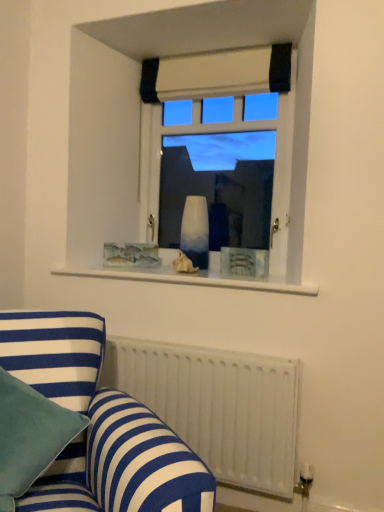
Question: Is white metallic radiator at lower right bigger than teal velvet pillow at lower left?

Choices:
 (A) yes
 (B) no

Answer: (A)

Question: Is the position of white metallic radiator at lower right more distant than that of teal velvet pillow at lower left?

Choices:
 (A) yes
 (B) no

Answer: (A)

Question: Is the surface of white metallic radiator at lower right in direct contact with teal velvet pillow at lower left?

Choices:
 (A) yes
 (B) no

Answer: (B)

Question: From a real-world perspective, is white metallic radiator at lower right over teal velvet pillow at lower left?

Choices:
 (A) no
 (B) yes

Answer: (A)

Question: Considering the relative positions of white metallic radiator at lower right and teal velvet pillow at lower left in the image provided, is white metallic radiator at lower right to the left of teal velvet pillow at lower left from the viewer's perspective?

Choices:
 (A) no
 (B) yes

Answer: (A)

Question: Are white metallic radiator at lower right and teal velvet pillow at lower left far apart?

Choices:
 (A) yes
 (B) no

Answer: (B)

Question: Is beige fabric curtain at upper center at the left side of white glass vase at center?

Choices:
 (A) no
 (B) yes

Answer: (A)

Question: Does beige fabric curtain at upper center turn towards white glass vase at center?

Choices:
 (A) no
 (B) yes

Answer: (A)

Question: Is beige fabric curtain at upper center shorter than white glass vase at center?

Choices:
 (A) yes
 (B) no

Answer: (A)

Question: Is beige fabric curtain at upper center wider than white glass vase at center?

Choices:
 (A) no
 (B) yes

Answer: (A)

Question: Does beige fabric curtain at upper center lie in front of white glass vase at center?

Choices:
 (A) yes
 (B) no

Answer: (A)

Question: Is beige fabric curtain at upper center not near white glass vase at center?

Choices:
 (A) no
 (B) yes

Answer: (A)

Question: From a real-world perspective, is beige fabric curtain at upper center positioned under blue striped fabric couch at lower left based on gravity?

Choices:
 (A) yes
 (B) no

Answer: (B)